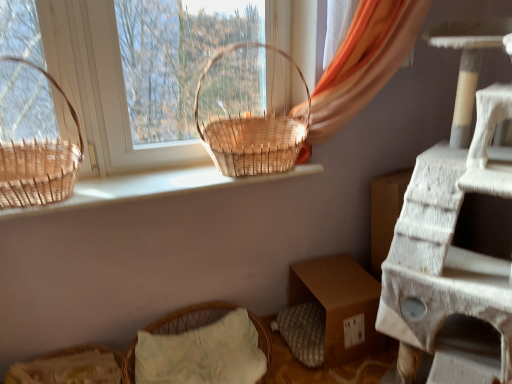
Question: Considering the positions of woven straw basket at lower left and orange fabric curtain at upper right in the image, is woven straw basket at lower left wider or thinner than orange fabric curtain at upper right?

Choices:
 (A) thin
 (B) wide

Answer: (B)

Question: Is point (10, 377) positioned closer to the camera than point (352, 112)?

Choices:
 (A) closer
 (B) farther

Answer: (A)

Question: Estimate the real-world distances between objects in this image. Which object is farther from the woven natural basket at center, which appears as the 1th picnic basket when viewed from the right?

Choices:
 (A) light green fabric pillow at lower center
 (B) brown woven basket at left, the second picnic basket viewed from the right
 (C) natural wood basket at upper center
 (D) woven straw basket at lower left
 (E) orange fabric curtain at upper right

Answer: (D)

Question: Estimate the real-world distances between objects in this image. Which object is closer to the light green fabric pillow at lower center?

Choices:
 (A) orange fabric curtain at upper right
 (B) woven natural basket at center, which appears as the 1th picnic basket when viewed from the right
 (C) woven straw basket at lower left
 (D) natural wood basket at upper center
 (E) brown woven basket at left, the second picnic basket viewed from the right

Answer: (C)